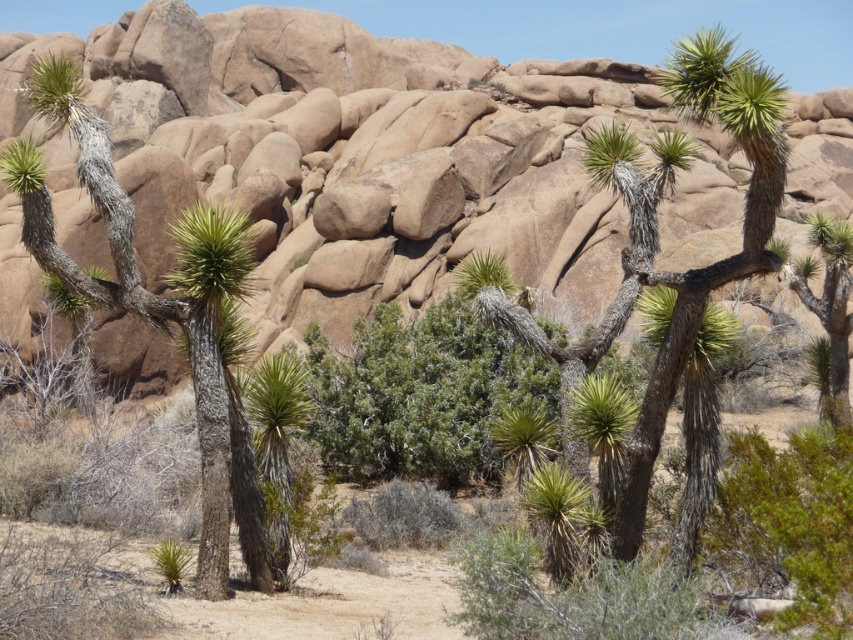
You are a botanist studying desert plants. You observe the gray bark tree at center and the green spiky plant at center in the desert scene. Which of these two occupies a smaller area in the image?

The gray bark tree at center occupies less space than the green spiky plant at center, so the gray bark tree at center is the one that occupies a smaller area in the image.

You are standing in the desert and want to take a photo of the gray bark tree at center. If your camera has a maximum focus range of 15 meters, will you be able to focus on the tree?

The gray bark tree at center is 14.92 meters away from the viewer, which is within the camera maximum focus range of 15 meters. Therefore, the camera can focus on the gray bark tree at center.

You are a hiker in the desert and want to determine which plant has a thicker trunk between the gray bark tree at center and the green spiky plant at center. Based on the scene, which one is thicker?

The gray bark tree at center is thinner than the green spiky plant at center, so the green spiky plant at center has a thicker trunk.